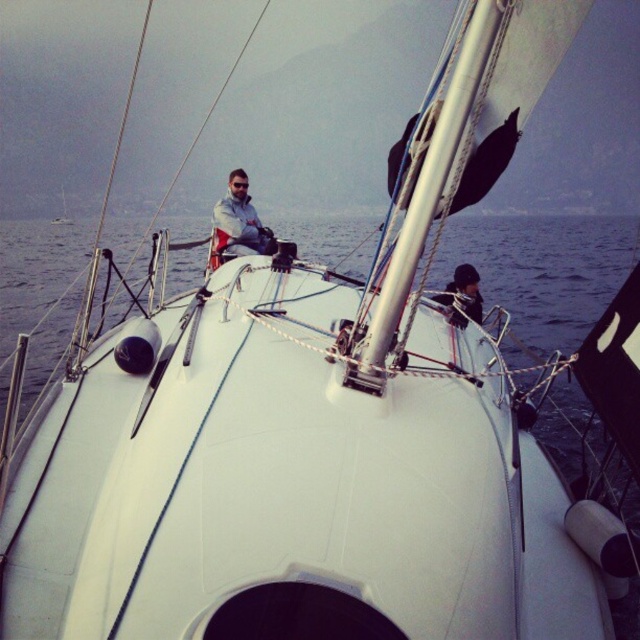
Between point (237, 236) and point (60, 218), which one is positioned behind?

The point (60, 218) is behind.

Is point (259, 240) positioned in front of point (67, 218)?

Yes, it is in front of point (67, 218).

Locate an element on the screen. This screenshot has width=640, height=640. white matte jacket at center is located at coordinates (237, 225).

Is white matte jacket at center bigger than black matte jacket at center?

Correct, white matte jacket at center is larger in size than black matte jacket at center.

Is white matte jacket at center taller than black matte jacket at center?

Yes.

What do you see at coordinates (237, 225) in the screenshot?
I see `white matte jacket at center` at bounding box center [237, 225].

Identify the location of white matte jacket at center. Image resolution: width=640 pixels, height=640 pixels. [x=237, y=225].

Who is higher up, white matte water at center or black matte jacket at center?

white matte water at center

Between white matte water at center and black matte jacket at center, which one has more height?

Standing taller between the two is white matte water at center.

Does point (33, 305) lie behind point (435, 298)?

Yes.

The image size is (640, 640). In order to click on white matte water at center in this screenshot , I will do `click(541, 273)`.